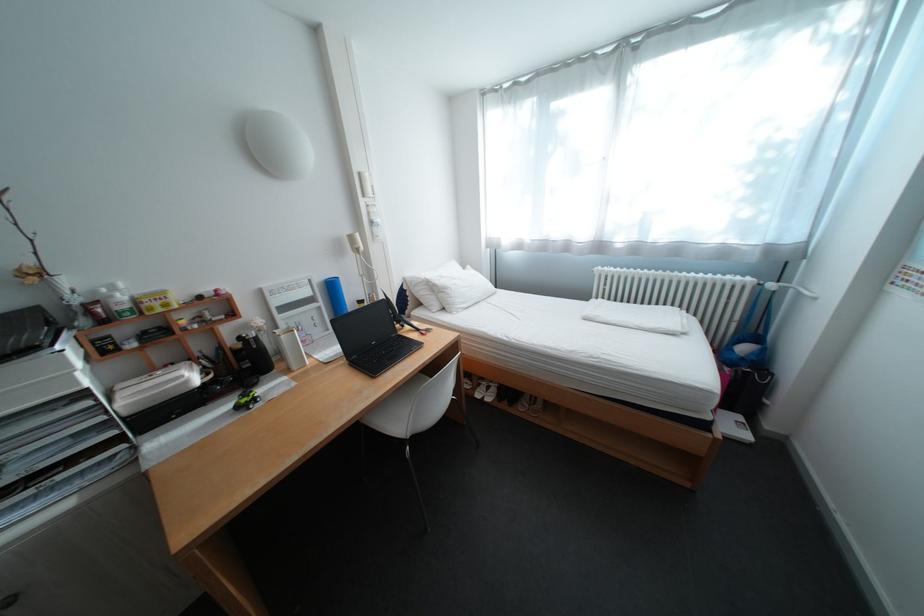
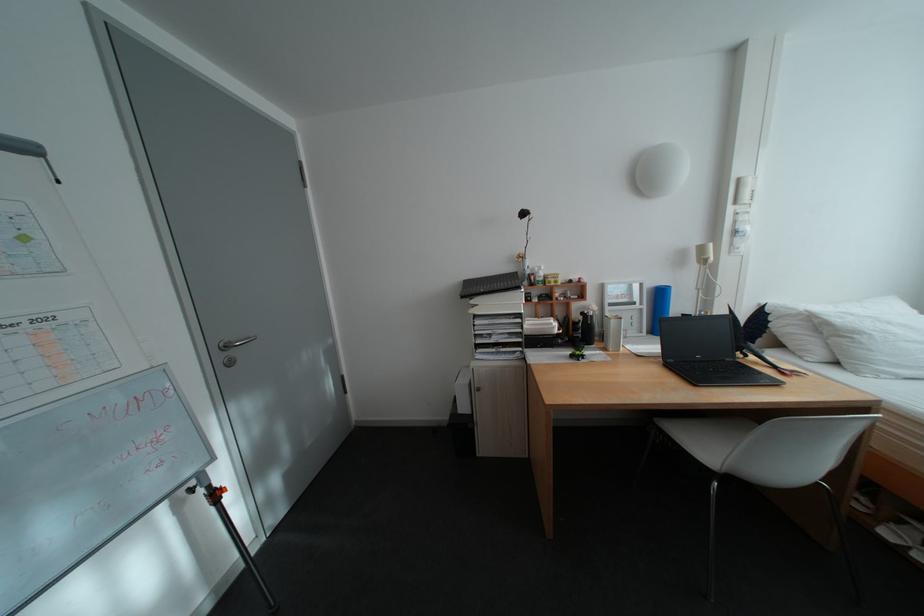
Question: The first image is from the beginning of the video and the second image is from the end. How did the camera likely rotate when shooting the video?

Choices:
 (A) Left
 (B) Right
 (C) Up
 (D) Down

Answer: (A)